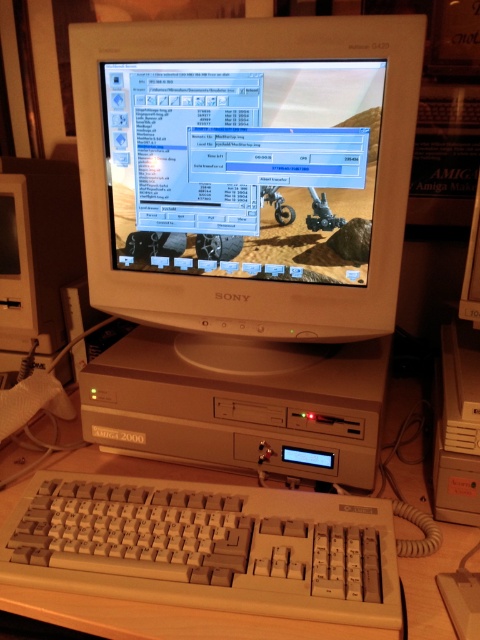
What do you see at coordinates (248, 176) in the screenshot?
I see `white plastic monitor at center` at bounding box center [248, 176].

Is white plastic monitor at center positioned behind white plastic keyboard at lower center?

Yes, it is behind white plastic keyboard at lower center.

Between point (283, 138) and point (120, 563), which one is positioned behind?

Positioned behind is point (283, 138).

Locate an element on the screen. white plastic monitor at center is located at coordinates (248, 176).